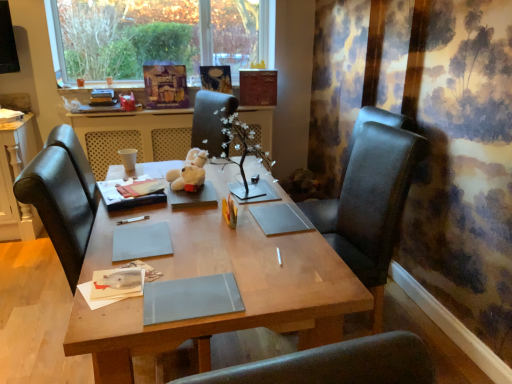
Find the location of a particular element. The image size is (512, 384). unoccupied region to the right of matte gray notebook at center, placed as the first notebook when sorted from front to back is located at coordinates (287, 285).